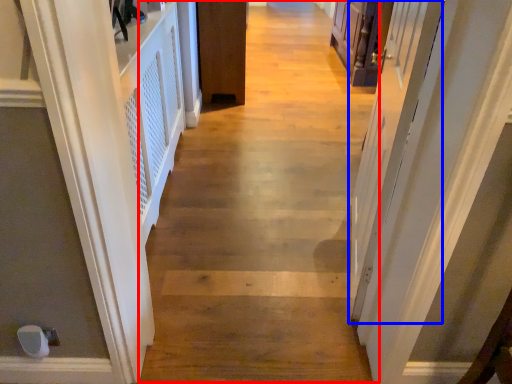
Question: Which point is closer to the camera, path (highlighted by a red box) or screen door (highlighted by a blue box)?

Choices:
 (A) path
 (B) screen door

Answer: (B)